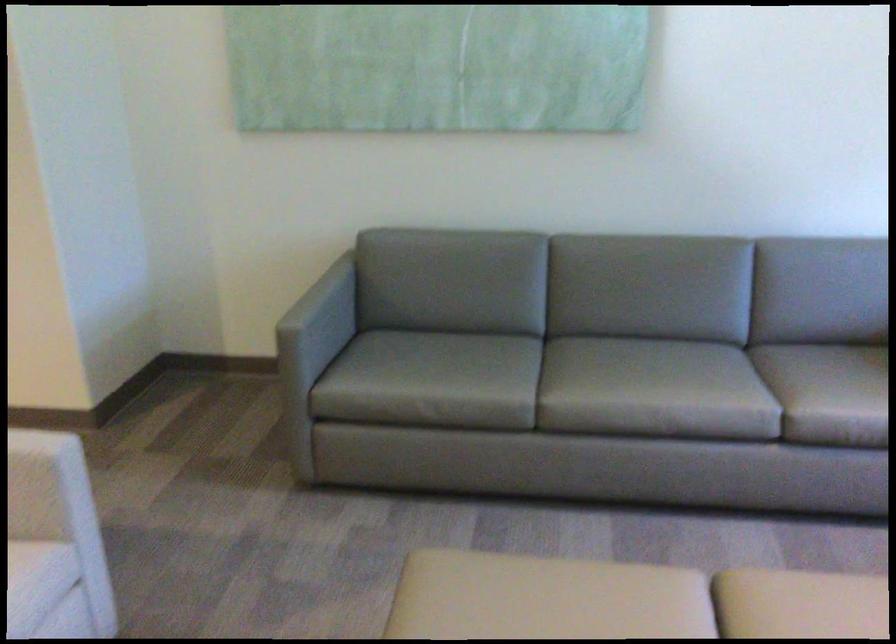
What do you see at coordinates (321, 313) in the screenshot? This screenshot has width=896, height=644. I see `the grey sofa armrest` at bounding box center [321, 313].